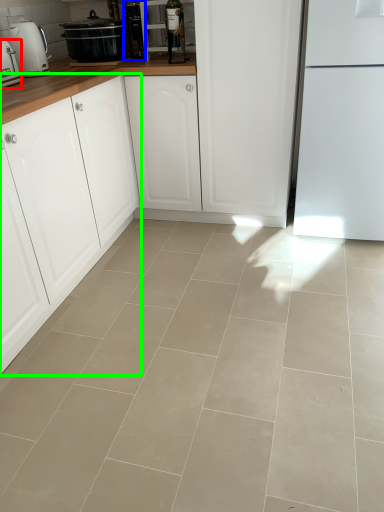
Question: Which is nearer to the kitchen appliance (highlighted by a red box)? appliance (highlighted by a blue box) or cabinetry (highlighted by a green box).

Choices:
 (A) appliance
 (B) cabinetry

Answer: (B)